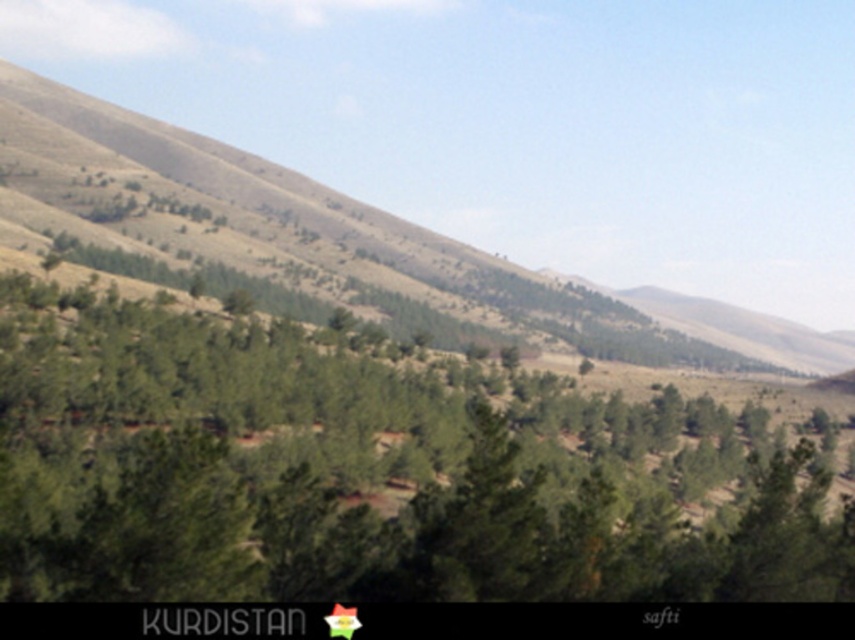
You are an environmental scientist assessing the landscape. You need to determine which object occupies more space in the scene. Which is larger in size between the green leafy tree at center and the green grassy hillside at center?

The green grassy hillside at center is larger in size compared to the green leafy tree at center.

You are standing at the point with coordinates point (410,241) and want to walk towards the point with coordinates point (175,580). According to the scene, will you have to go through the dense cluster of green trees in the foreground?

Point (175,580) is in front of point (410,241), so you will have to go through the dense cluster of green trees in the foreground to reach it.